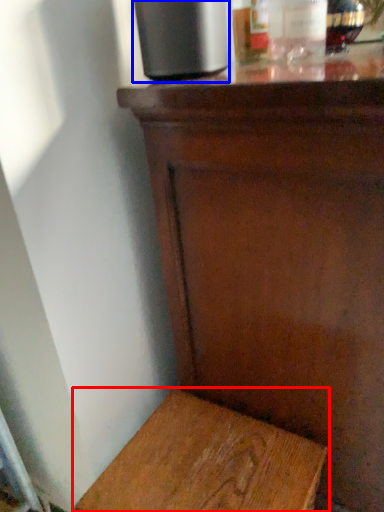
Question: Which of the following is the closest to the observer, furniture (highlighted by a red box) or appliance (highlighted by a blue box)?

Choices:
 (A) furniture
 (B) appliance

Answer: (B)